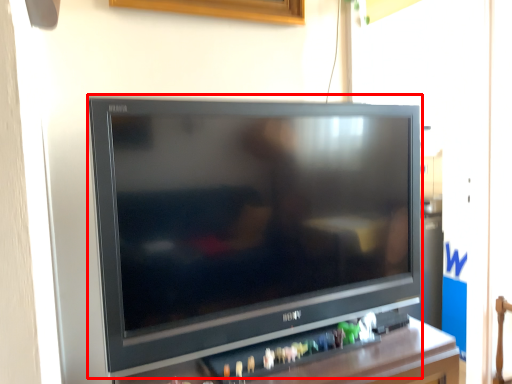
Question: From the image's perspective, what is the correct spatial relationship of television (annotated by the red box) in relation to furniture?

Choices:
 (A) above
 (B) below

Answer: (A)